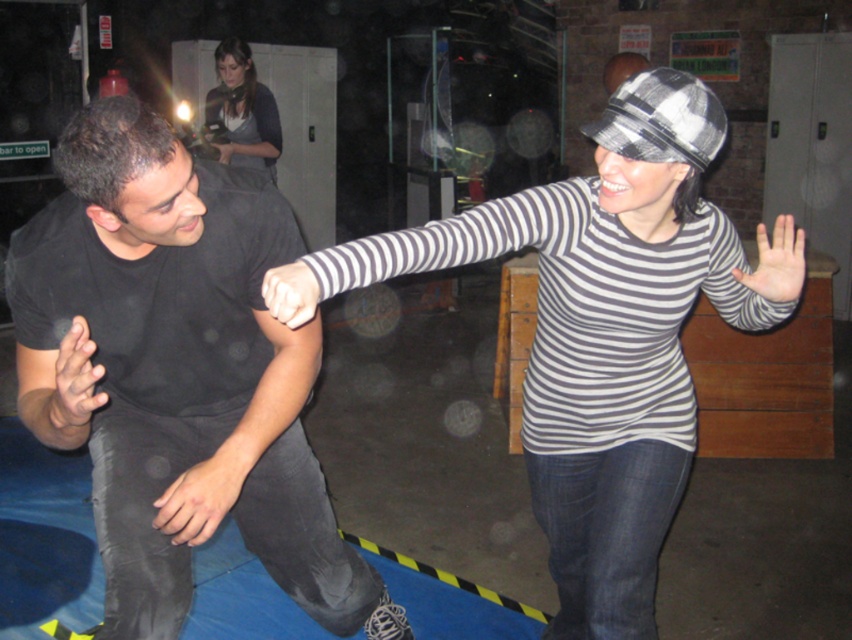
You are standing in the room and want to locate the black matte shirt at left. According to the coordinates provided, where would you look relative to the center of the image?

The black matte shirt at left is located at coordinates 0.584 on the x axis and 0.209 on the y axis, which places it to the right and slightly below the center of the image.

In the scene shown: You are a photographer setting up for a photo shoot in this room. You need to position a spotlight so that it illuminates the black matte shirt at left without affecting the matte gray sweater at upper center. Based on their positions, can you do this?

Yes, the black matte shirt at left is in front of the matte gray sweater at upper center, so positioning the spotlight to shine on the black matte shirt at left while angling it away from the matte gray sweater at upper center would work.